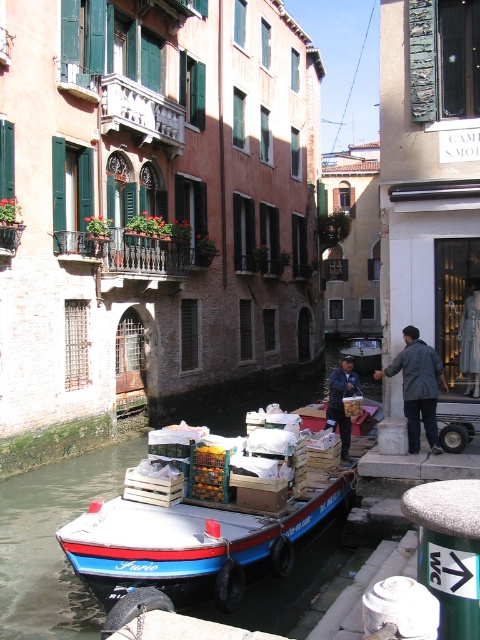
Measure the distance from blue painted wooden boat at center to blue wooden boat at center.

blue painted wooden boat at center and blue wooden boat at center are 133.15 feet apart from each other.

Is blue painted wooden boat at center to the right of blue wooden boat at center from the viewer's perspective?

Incorrect, blue painted wooden boat at center is not on the right side of blue wooden boat at center.

Is point (340, 468) farther from viewer compared to point (360, 337)?

No.

Find the location of a particular element. The width and height of the screenshot is (480, 640). blue painted wooden boat at center is located at coordinates (197, 541).

Is point (408, 381) less distant than point (380, 339)?

Yes, point (408, 381) is in front of point (380, 339).

Is dark gray jacket at center wider than blue wooden boat at center?

Correct, the width of dark gray jacket at center exceeds that of blue wooden boat at center.

The height and width of the screenshot is (640, 480). What are the coordinates of `dark gray jacket at center` in the screenshot? It's located at (418, 387).

Can you confirm if dark blue jeans at center is thinner than blue wooden boat at center?

In fact, dark blue jeans at center might be wider than blue wooden boat at center.

Find the location of a particular element. The height and width of the screenshot is (640, 480). dark blue jeans at center is located at coordinates (342, 401).

Describe the element at coordinates (342, 401) in the screenshot. I see `dark blue jeans at center` at that location.

The height and width of the screenshot is (640, 480). Find the location of `dark blue jeans at center`. dark blue jeans at center is located at coordinates (342, 401).